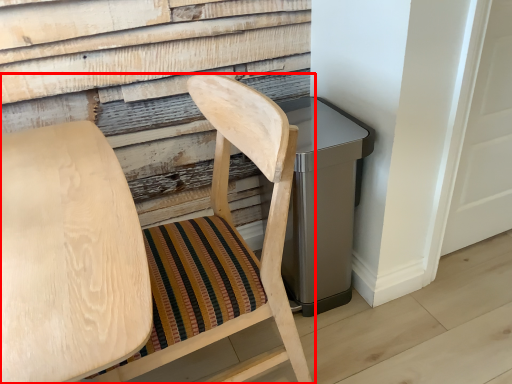
Question: From the image's perspective, considering the relative positions of chair (annotated by the red box) and chair in the image provided, where is chair (annotated by the red box) located with respect to the staircase?

Choices:
 (A) below
 (B) above

Answer: (B)